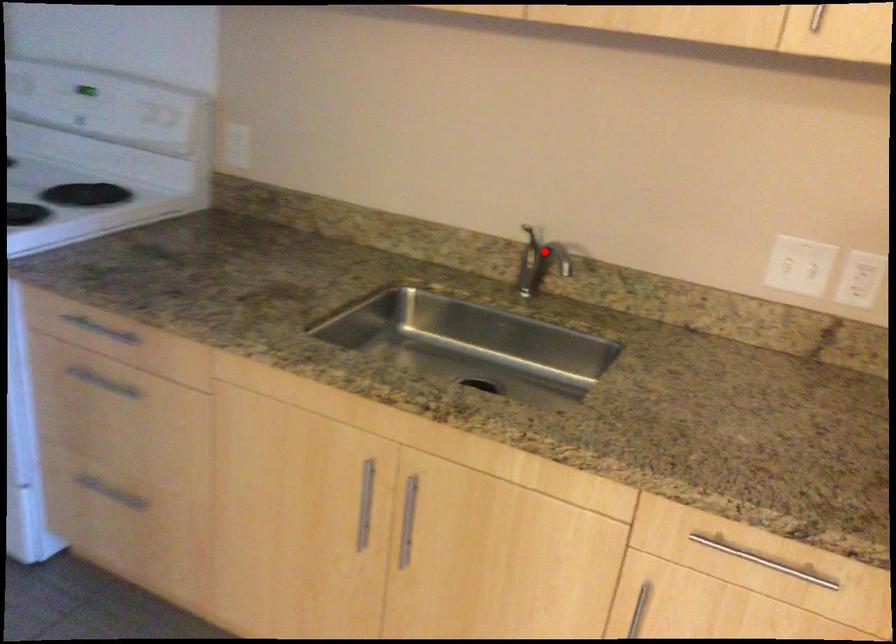
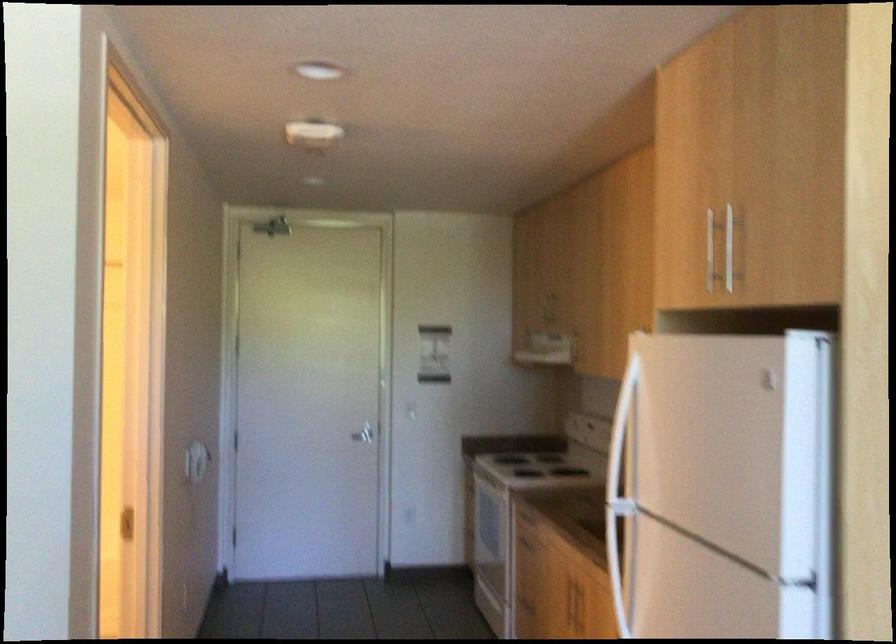
Question: I am providing you with two images of the same scene from different viewpoints. A red point is marked on the first image. At the location where the point appears in image 1, is it still visible in image 2?

Choices:
 (A) Yes
 (B) No

Answer: (B)